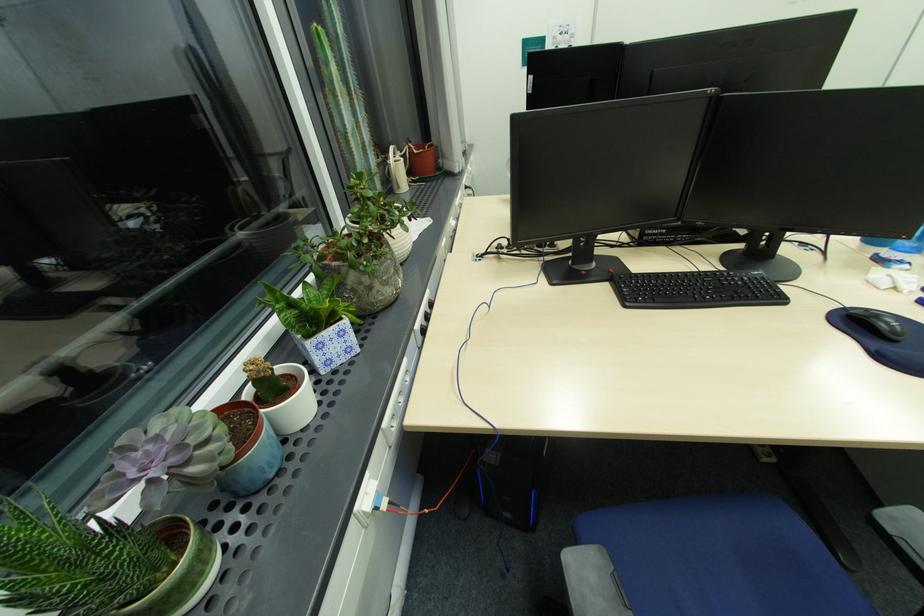
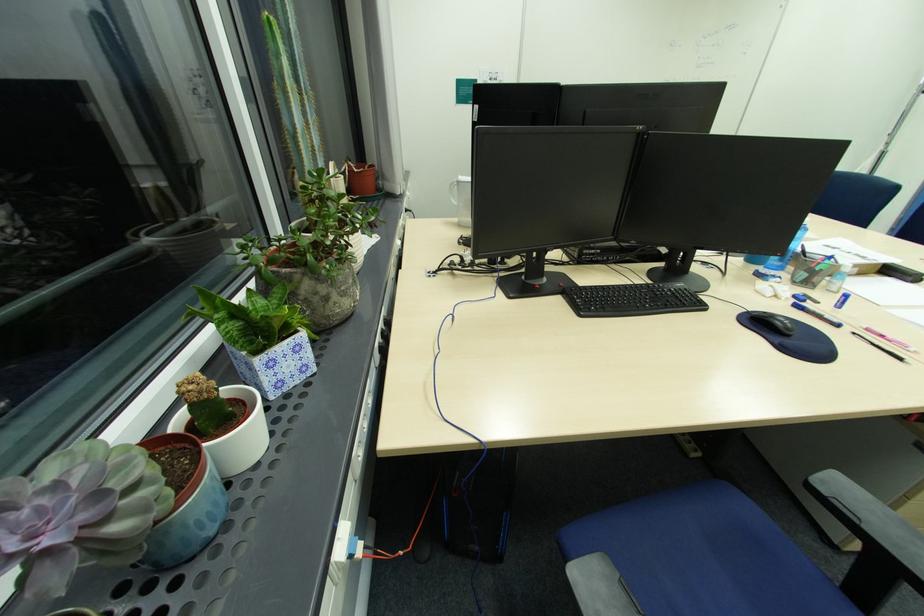
Question: The images are taken continuously from a first-person perspective. In which direction is your viewpoint rotating?

Choices:
 (A) Left
 (B) Right
 (C) Up
 (D) Down

Answer: (B)